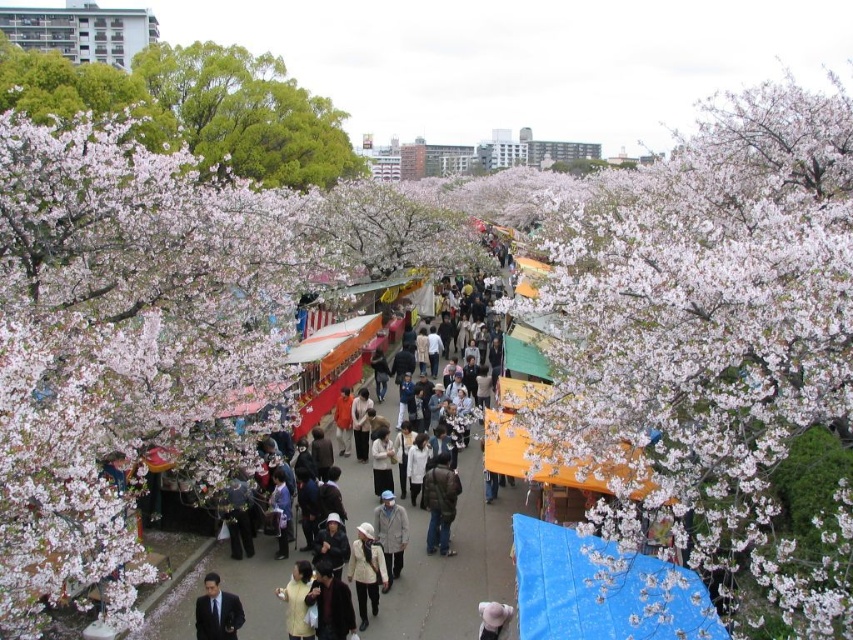
Find the location of `dark suit at lower left`. dark suit at lower left is located at coordinates (218, 611).

Does dark suit at lower left have a greater height compared to light gray fabric jacket at center?

No, dark suit at lower left is not taller than light gray fabric jacket at center.

Is point (221, 616) less distant than point (397, 557)?

Yes, it is.

Locate an element on the screen. The image size is (853, 640). dark suit at lower left is located at coordinates (218, 611).

Who is more forward, (x=0, y=378) or (x=387, y=547)?

Positioned in front is point (x=0, y=378).

Is fluffy white blossoms at left behind light gray fabric jacket at center?

No, fluffy white blossoms at left is closer to the viewer.

Where is `fluffy white blossoms at left`? The height and width of the screenshot is (640, 853). fluffy white blossoms at left is located at coordinates pyautogui.click(x=125, y=342).

Locate an element on the screen. fluffy white blossoms at left is located at coordinates (125, 342).

Based on the photo, is green leafy tree at upper left thinner than white textured coat at center?

No, green leafy tree at upper left is not thinner than white textured coat at center.

What do you see at coordinates (248, 113) in the screenshot? This screenshot has height=640, width=853. I see `green leafy tree at upper left` at bounding box center [248, 113].

Is point (175, 45) closer to viewer compared to point (357, 595)?

No, it is not.

Locate an element on the screen. green leafy tree at upper left is located at coordinates (248, 113).